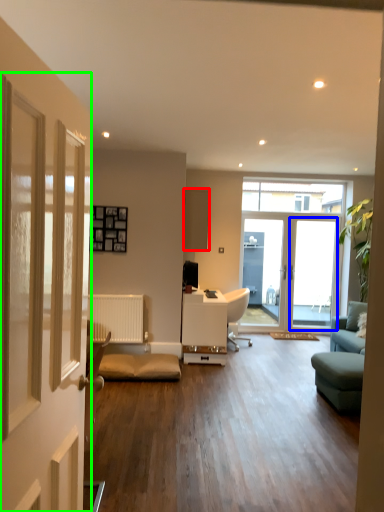
Question: Considering the real-world distances, which object is closest to cabinetry (highlighted by a red box)? screen door (highlighted by a blue box) or door (highlighted by a green box).

Choices:
 (A) screen door
 (B) door

Answer: (A)